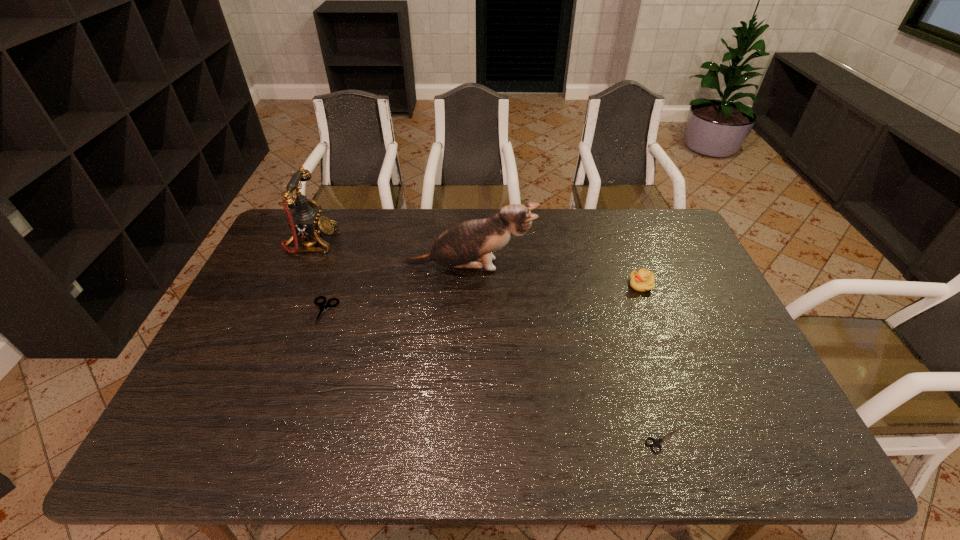
You are a GUI agent. You are given a task and a screenshot of the screen. Output one action in this format:
    pyautogui.click(x=<x>, y=<y>)
    Task: Click on the free space located on the front-facing side of the third tallest object
    This screenshot has width=960, height=540.
    Given the screenshot: What is the action you would take?
    (x=588, y=285)

This screenshot has height=540, width=960. What are the coordinates of `blank space located on the front-facing side of the third tallest object` in the screenshot? It's located at (610, 285).

What are the coordinates of `vacant space situated 0.140m on the left of the second nearest object` in the screenshot? It's located at (263, 311).

Locate an element on the screen. The image size is (960, 540). vacant space located on the back of the nearest object is located at coordinates (625, 314).

At what (x,y) coordinates should I click in order to perform the action: click on object positioned at the far edge. Please return your answer as a coordinate pair (x, y). Looking at the image, I should click on (306, 222).

Locate an element on the screen. The height and width of the screenshot is (540, 960). object that is at the near edge is located at coordinates (657, 442).

The height and width of the screenshot is (540, 960). What are the coordinates of `object at the left edge` in the screenshot? It's located at (306, 222).

Where is `object located at the far left corner`? object located at the far left corner is located at coordinates (306, 222).

Locate an element on the screen. Image resolution: width=960 pixels, height=540 pixels. free space at the far edge of the desktop is located at coordinates (636, 237).

Image resolution: width=960 pixels, height=540 pixels. I want to click on vacant point at the near edge, so click(x=593, y=442).